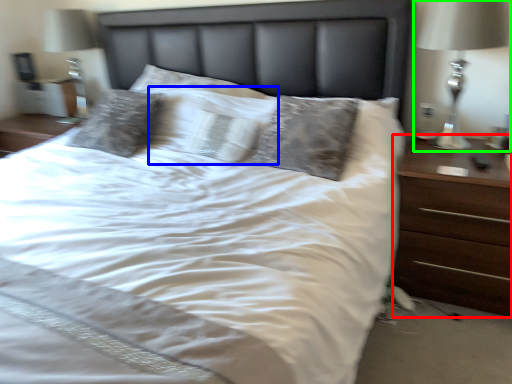
Question: Based on their relative distances, which object is farther from nightstand (highlighted by a red box)? Choose from pillow (highlighted by a blue box) and bedside lamp (highlighted by a green box).

Choices:
 (A) pillow
 (B) bedside lamp

Answer: (A)